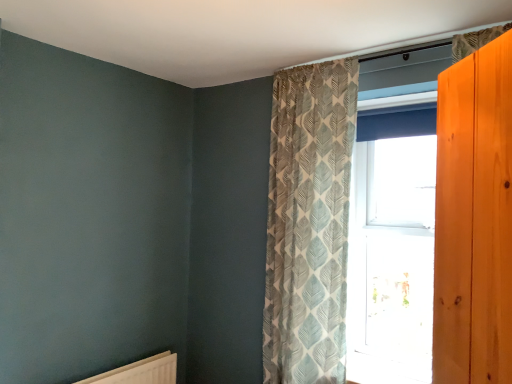
Question: Considering the relative sizes of textured beige curtain at upper center and clear glass window at center in the image provided, is textured beige curtain at upper center shorter than clear glass window at center?

Choices:
 (A) yes
 (B) no

Answer: (B)

Question: Is textured beige curtain at upper center to the right of clear glass window at center from the viewer's perspective?

Choices:
 (A) yes
 (B) no

Answer: (B)

Question: Is textured beige curtain at upper center outside of clear glass window at center?

Choices:
 (A) no
 (B) yes

Answer: (B)

Question: Is textured beige curtain at upper center to the left of clear glass window at center from the viewer's perspective?

Choices:
 (A) yes
 (B) no

Answer: (A)

Question: Is textured beige curtain at upper center smaller than clear glass window at center?

Choices:
 (A) no
 (B) yes

Answer: (A)

Question: From the image's perspective, is clear glass window at center located above or below white matte radiator at lower left?

Choices:
 (A) above
 (B) below

Answer: (A)

Question: In the image, is clear glass window at center on the left side or the right side of white matte radiator at lower left?

Choices:
 (A) left
 (B) right

Answer: (B)

Question: Considering their positions, is clear glass window at center located in front of or behind white matte radiator at lower left?

Choices:
 (A) behind
 (B) front

Answer: (A)

Question: From a real-world perspective, is clear glass window at center above or below white matte radiator at lower left?

Choices:
 (A) below
 (B) above

Answer: (B)

Question: Is white matte radiator at lower left taller or shorter than clear glass window at center?

Choices:
 (A) short
 (B) tall

Answer: (A)

Question: Considering the positions of white matte radiator at lower left and clear glass window at center in the image, is white matte radiator at lower left wider or thinner than clear glass window at center?

Choices:
 (A) wide
 (B) thin

Answer: (B)

Question: From the image's perspective, is white matte radiator at lower left positioned above or below clear glass window at center?

Choices:
 (A) above
 (B) below

Answer: (B)

Question: Considering their positions, is white matte radiator at lower left located in front of or behind clear glass window at center?

Choices:
 (A) behind
 (B) front

Answer: (B)

Question: Based on their sizes in the image, would you say clear glass window at center is bigger or smaller than textured beige curtain at upper center?

Choices:
 (A) big
 (B) small

Answer: (B)

Question: From a real-world perspective, is clear glass window at center positioned above or below textured beige curtain at upper center?

Choices:
 (A) above
 (B) below

Answer: (A)